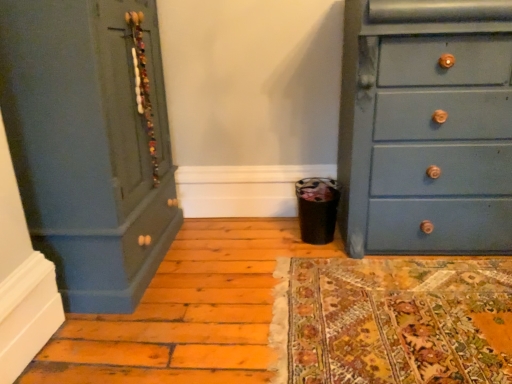
Question: Can you confirm if matte blue dresser at left, the 1th chest of drawers in the left-to-right sequence, is wider than matte blue dresser at right, marked as the first chest of drawers in a right-to-left arrangement?

Choices:
 (A) yes
 (B) no

Answer: (A)

Question: Is matte blue dresser at left, the 1th chest of drawers in the left-to-right sequence, looking in the opposite direction of matte blue dresser at right, placed as the second chest of drawers when sorted from left to right?

Choices:
 (A) yes
 (B) no

Answer: (B)

Question: Is matte blue dresser at left, the 1th chest of drawers in the left-to-right sequence, beside matte blue dresser at right, marked as the first chest of drawers in a right-to-left arrangement?

Choices:
 (A) yes
 (B) no

Answer: (B)

Question: Considering the relative sizes of matte blue dresser at left, positioned as the 2th chest of drawers in right-to-left order, and matte blue dresser at right, marked as the first chest of drawers in a right-to-left arrangement, in the image provided, is matte blue dresser at left, positioned as the 2th chest of drawers in right-to-left order, thinner than matte blue dresser at right, marked as the first chest of drawers in a right-to-left arrangement,?

Choices:
 (A) yes
 (B) no

Answer: (B)

Question: Is matte blue dresser at left, positioned as the 2th chest of drawers in right-to-left order, not near matte blue dresser at right, marked as the first chest of drawers in a right-to-left arrangement?

Choices:
 (A) no
 (B) yes

Answer: (B)

Question: From the image's perspective, is matte blue dresser at left, the 1th chest of drawers in the left-to-right sequence, on matte blue dresser at right, placed as the second chest of drawers when sorted from left to right?

Choices:
 (A) no
 (B) yes

Answer: (A)

Question: Is matte blue dresser at right, placed as the second chest of drawers when sorted from left to right, not close to matte blue dresser at left, the 1th chest of drawers in the left-to-right sequence?

Choices:
 (A) yes
 (B) no

Answer: (A)

Question: Does matte blue dresser at right, marked as the first chest of drawers in a right-to-left arrangement, have a greater width compared to matte blue dresser at left, positioned as the 2th chest of drawers in right-to-left order?

Choices:
 (A) no
 (B) yes

Answer: (A)

Question: From the image's perspective, would you say matte blue dresser at right, placed as the second chest of drawers when sorted from left to right, is shown under matte blue dresser at left, positioned as the 2th chest of drawers in right-to-left order?

Choices:
 (A) no
 (B) yes

Answer: (A)

Question: Considering the relative sizes of matte blue dresser at right, marked as the first chest of drawers in a right-to-left arrangement, and matte blue dresser at left, positioned as the 2th chest of drawers in right-to-left order, in the image provided, is matte blue dresser at right, marked as the first chest of drawers in a right-to-left arrangement, smaller than matte blue dresser at left, positioned as the 2th chest of drawers in right-to-left order,?

Choices:
 (A) yes
 (B) no

Answer: (A)

Question: From a real-world perspective, is matte blue dresser at right, marked as the first chest of drawers in a right-to-left arrangement, physically below matte blue dresser at left, positioned as the 2th chest of drawers in right-to-left order?

Choices:
 (A) no
 (B) yes

Answer: (B)

Question: Considering the relative sizes of matte blue dresser at right, placed as the second chest of drawers when sorted from left to right, and matte blue dresser at left, the 1th chest of drawers in the left-to-right sequence, in the image provided, is matte blue dresser at right, placed as the second chest of drawers when sorted from left to right, taller than matte blue dresser at left, the 1th chest of drawers in the left-to-right sequence,?

Choices:
 (A) no
 (B) yes

Answer: (A)

Question: Do you think matte blue dresser at right, placed as the second chest of drawers when sorted from left to right, is within matte blue dresser at left, the 1th chest of drawers in the left-to-right sequence, or outside of it?

Choices:
 (A) inside
 (B) outside

Answer: (B)